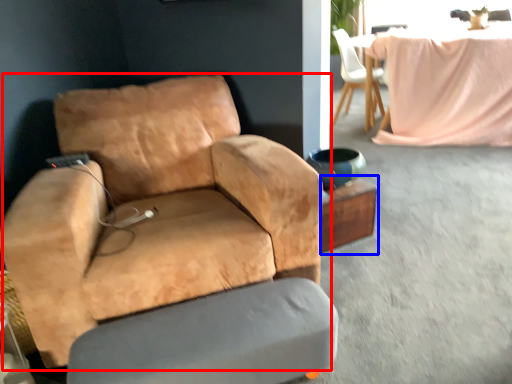
Question: Which of the following is the closest to the observer, chair (highlighted by a red box) or side table (highlighted by a blue box)?

Choices:
 (A) chair
 (B) side table

Answer: (A)